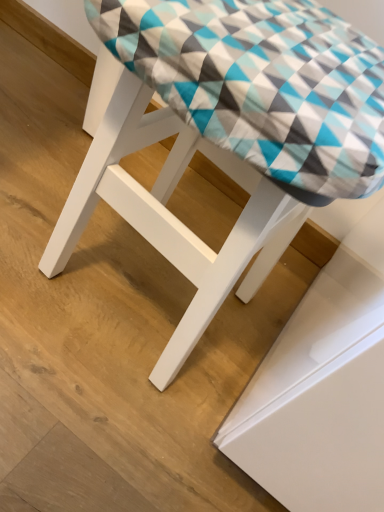
You are a GUI agent. You are given a task and a screenshot of the screen. Output one action in this format:
    pyautogui.click(x=<x>, y=<y>)
    Task: Click on the vacant space underneath white matte stool at center (from a real-world perspective)
    
    Given the screenshot: What is the action you would take?
    pyautogui.click(x=136, y=291)